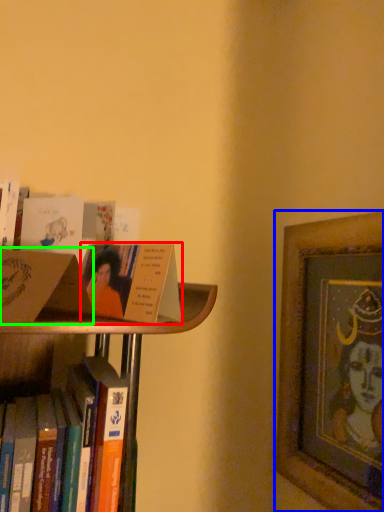
Question: Based on their relative distances, which object is nearer to book (highlighted by a red box)? Choose from picture frame (highlighted by a blue box) and paperback book (highlighted by a green box).

Choices:
 (A) picture frame
 (B) paperback book

Answer: (B)